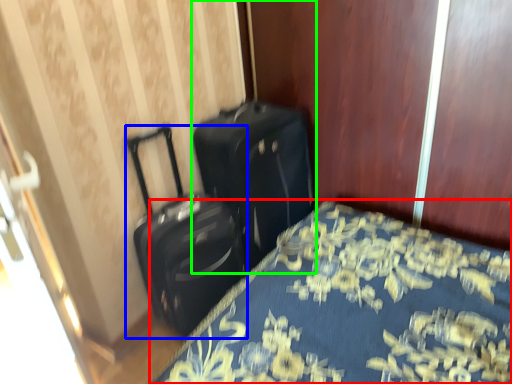
Question: Which is nearer to the bed (highlighted by a red box)? suitcase (highlighted by a blue box) or suitcase (highlighted by a green box).

Choices:
 (A) suitcase
 (B) suitcase

Answer: (B)